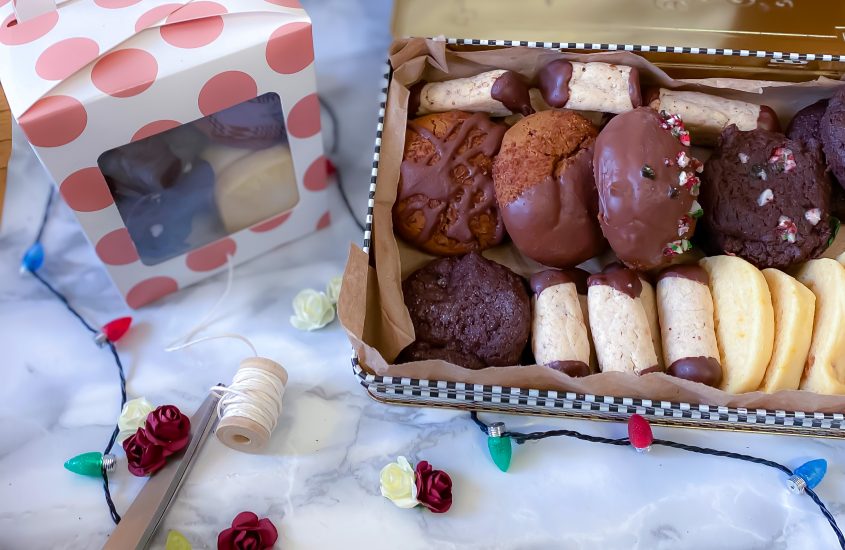
Find the location of a particular element. white and pink spotted box is located at coordinates (254, 48).